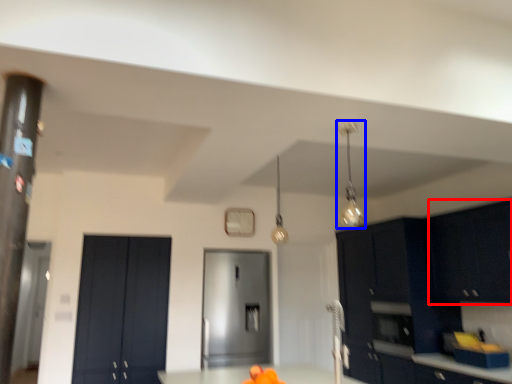
Question: Among these objects, which one is farthest to the camera, cabinetry (highlighted by a red box) or light fixture (highlighted by a blue box)?

Choices:
 (A) cabinetry
 (B) light fixture

Answer: (A)